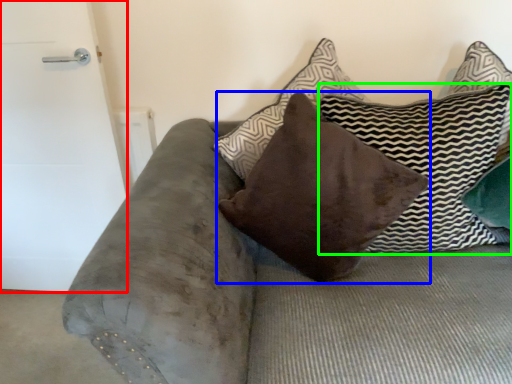
Question: Estimate the real-world distances between objects in this image. Which object is farther from door (highlighted by a red box), pillow (highlighted by a blue box) or pillow (highlighted by a green box)?

Choices:
 (A) pillow
 (B) pillow

Answer: (B)